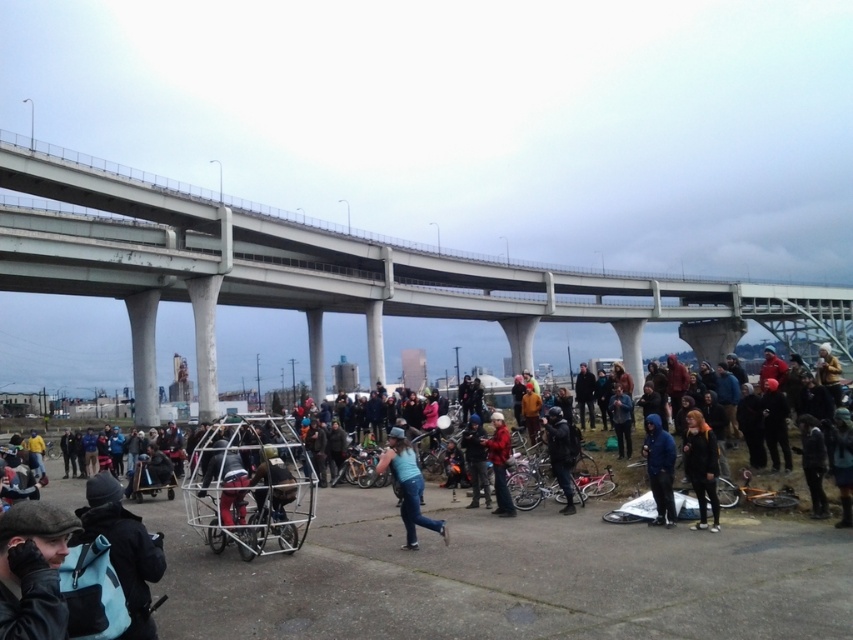
How distant is dark gray hoodie at center from dark blue fabric jacket at lower right?

dark gray hoodie at center and dark blue fabric jacket at lower right are 8.42 meters apart.

Can you confirm if dark gray hoodie at center is positioned above dark blue fabric jacket at lower right?

Actually, dark gray hoodie at center is below dark blue fabric jacket at lower right.

This screenshot has width=853, height=640. What do you see at coordinates (701, 467) in the screenshot?
I see `dark gray hoodie at center` at bounding box center [701, 467].

At what (x,y) coordinates should I click in order to perform the action: click on dark gray hoodie at center. Please return your answer as a coordinate pair (x, y). This screenshot has height=640, width=853. Looking at the image, I should click on (701, 467).

Between blue matte jacket at lower right and red matte jacket at center, which one is positioned lower?

red matte jacket at center is lower down.

Does blue matte jacket at lower right appear on the left side of red matte jacket at center?

In fact, blue matte jacket at lower right is to the right of red matte jacket at center.

Identify the location of blue matte jacket at lower right. The width and height of the screenshot is (853, 640). (659, 468).

Can you confirm if dark blue fabric jacket at lower right is positioned to the left of black matte jacket at lower right?

No, dark blue fabric jacket at lower right is not to the left of black matte jacket at lower right.

This screenshot has height=640, width=853. Identify the location of dark blue fabric jacket at lower right. (840, 461).